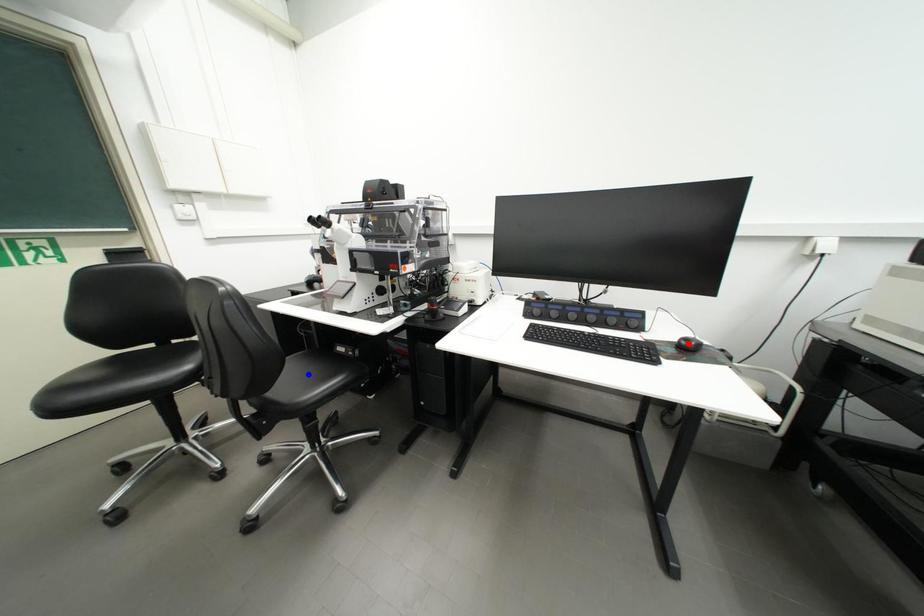
Question: Two points are marked on the image. Which point is closer to the camera?

Choices:
 (A) Blue point is closer.
 (B) Red point is closer.

Answer: (B)